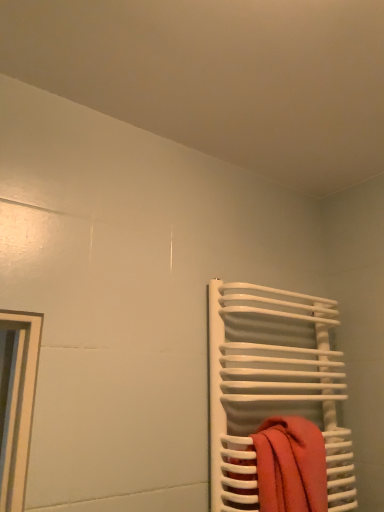
Where is `white glossy towel rack at right`? This screenshot has width=384, height=512. white glossy towel rack at right is located at coordinates (272, 386).

Describe the element at coordinates (272, 386) in the screenshot. This screenshot has height=512, width=384. I see `white glossy towel rack at right` at that location.

This screenshot has height=512, width=384. Describe the element at coordinates (290, 465) in the screenshot. I see `orange cotton towel at right` at that location.

This screenshot has height=512, width=384. Identify the location of orange cotton towel at right. (290, 465).

You are a GUI agent. You are given a task and a screenshot of the screen. Output one action in this format:
    pyautogui.click(x=<x>, y=<y>)
    Task: Click on the white glossy towel rack at right
    This screenshot has height=512, width=384.
    Given the screenshot: What is the action you would take?
    pyautogui.click(x=272, y=386)

Which object is positioned more to the right, orange cotton towel at right or white glossy towel rack at right?

white glossy towel rack at right.

Which object is more forward, orange cotton towel at right or white glossy towel rack at right?

orange cotton towel at right is more forward.

Which is nearer, [305,503] or [339,389]?

The point [305,503] is closer.

From the image's perspective, which one is positioned lower, orange cotton towel at right or white glossy towel rack at right?

From the image's view, orange cotton towel at right is below.

From a real-world perspective, is orange cotton towel at right positioned under white glossy towel rack at right based on gravity?

Yes, from a real-world perspective, orange cotton towel at right is under white glossy towel rack at right.

Which of these two, orange cotton towel at right or white glossy towel rack at right, is wider?

white glossy towel rack at right is wider.

Can you confirm if orange cotton towel at right is shorter than white glossy towel rack at right?

Correct, orange cotton towel at right is not as tall as white glossy towel rack at right.

Between orange cotton towel at right and white glossy towel rack at right, which one has smaller size?

Smaller between the two is orange cotton towel at right.

Is orange cotton towel at right spatially inside white glossy towel rack at right, or outside of it?

orange cotton towel at right is located inside white glossy towel rack at right.

Are orange cotton towel at right and white glossy towel rack at right far apart?

No, orange cotton towel at right is not far from white glossy towel rack at right.

Could you tell me if orange cotton towel at right is facing white glossy towel rack at right?

No, orange cotton towel at right is not aimed at white glossy towel rack at right.

What's the angular difference between orange cotton towel at right and white glossy towel rack at right's facing directions?

0.000111 degrees separate the facing orientations of orange cotton towel at right and white glossy towel rack at right.

I want to click on beach towel below the white glossy towel rack at right (from a real-world perspective), so click(x=290, y=465).

Consider the image. Is white glossy towel rack at right to the left of orange cotton towel at right from the viewer's perspective?

No, white glossy towel rack at right is not to the left of orange cotton towel at right.

Is the depth of white glossy towel rack at right less than that of orange cotton towel at right?

That is False.

Which point is more forward, (323, 391) or (310, 437)?

The point (310, 437) is closer to the camera.

From the image's perspective, is white glossy towel rack at right above orange cotton towel at right?

Yes, from the image's perspective, white glossy towel rack at right is above orange cotton towel at right.

From a real-world perspective, which is physically below, white glossy towel rack at right or orange cotton towel at right?

orange cotton towel at right, from a real-world perspective.

Between white glossy towel rack at right and orange cotton towel at right, which one has smaller width?

orange cotton towel at right is thinner.

Is white glossy towel rack at right taller or shorter than orange cotton towel at right?

In the image, white glossy towel rack at right appears to be taller than orange cotton towel at right.

Considering the sizes of objects white glossy towel rack at right and orange cotton towel at right in the image provided, who is bigger, white glossy towel rack at right or orange cotton towel at right?

Bigger between the two is white glossy towel rack at right.

Could orange cotton towel at right be considered to be inside white glossy towel rack at right?

Yes, orange cotton towel at right is a part of white glossy towel rack at right.

Is white glossy towel rack at right placed right next to orange cotton towel at right?

No, white glossy towel rack at right is not making contact with orange cotton towel at right.

Does white glossy towel rack at right turn towards orange cotton towel at right?

Yes, white glossy towel rack at right is aimed at orange cotton towel at right.

What's the angular difference between white glossy towel rack at right and orange cotton towel at right's facing directions?

The angular difference between white glossy towel rack at right and orange cotton towel at right is 0.000111 degrees.

Measure the distance from white glossy towel rack at right to orange cotton towel at right.

white glossy towel rack at right is 7.96 inches from orange cotton towel at right.

Identify the location of towel rack that appears above the orange cotton towel at right (from a real-world perspective). Image resolution: width=384 pixels, height=512 pixels. (272, 386).

Identify the location of beach towel located in front of the white glossy towel rack at right. (290, 465).

The image size is (384, 512). I want to click on towel rack lying above the orange cotton towel at right (from the image's perspective), so click(272, 386).